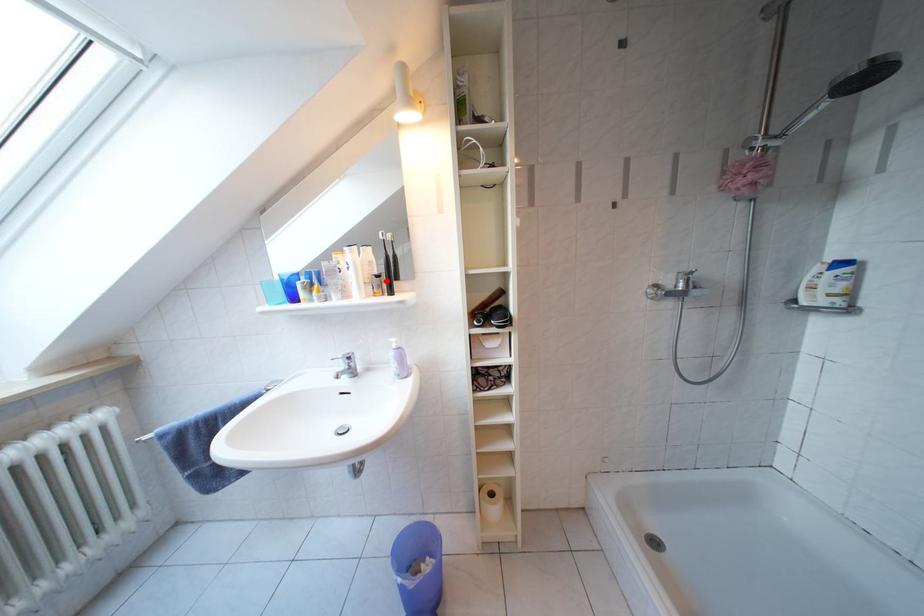
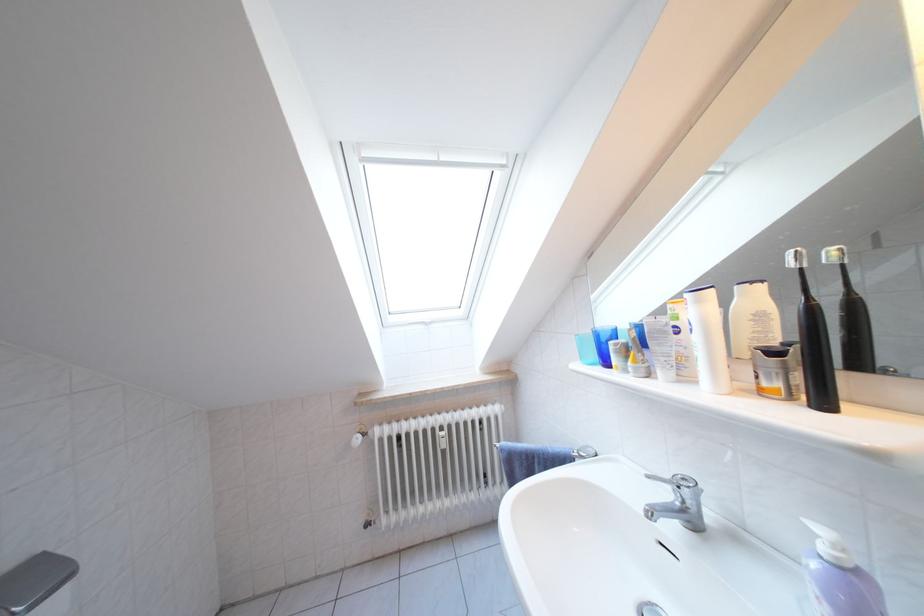
Locate, in the second image, the point that corresponds to the highlighted location in the first image.

(783, 359)